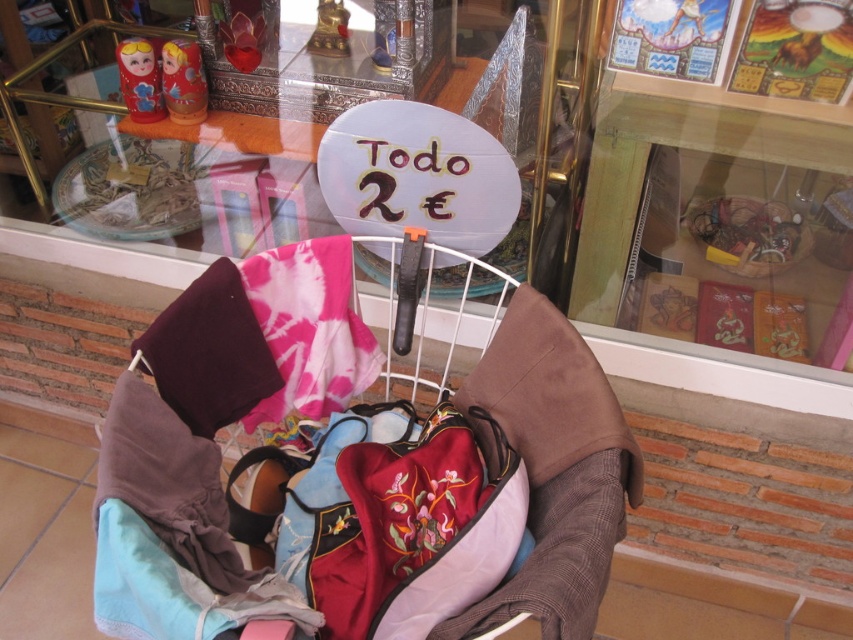
Question: Which point is farther from the camera taking this photo?

Choices:
 (A) click(181, 93)
 (B) click(152, 93)
 (C) click(770, 257)

Answer: (C)

Question: From the image, what is the correct spatial relationship of velvet-like fabric baby carriage at center in relation to wooden textured basket at upper right?

Choices:
 (A) left
 (B) right

Answer: (A)

Question: Can you confirm if wooden textured basket at upper right is positioned to the left of matte plastic doll at upper left?

Choices:
 (A) yes
 (B) no

Answer: (B)

Question: Which of the following is the farthest from the observer?

Choices:
 (A) (180, 74)
 (B) (202, 449)

Answer: (A)

Question: Is pink tie-dye fabric at center to the left of wooden textured basket at upper right from the viewer's perspective?

Choices:
 (A) no
 (B) yes

Answer: (B)

Question: Which point is farther to the camera?

Choices:
 (A) (722, 246)
 (B) (161, 84)
 (C) (283, 273)

Answer: (A)